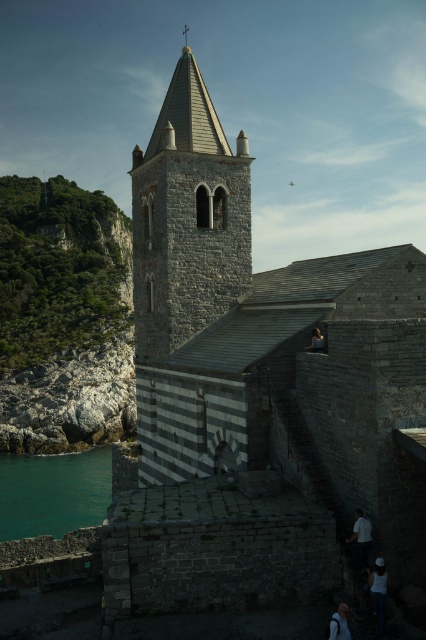
Looking at this image, is gray stone church at center bigger than smooth gray hair at center?

Yes, gray stone church at center is bigger than smooth gray hair at center.

Is gray stone church at center shorter than smooth gray hair at center?

No.

In order to click on gray stone church at center in this screenshot , I will do `click(256, 392)`.

Is point (276, 428) closer to camera compared to point (219, 282)?

Yes, it is.

Is gray stone church at center shorter than gray stone tower at center?

In fact, gray stone church at center may be taller than gray stone tower at center.

What are the coordinates of `gray stone church at center` in the screenshot? It's located at (256, 392).

Where is `gray stone church at center`? gray stone church at center is located at coordinates (256, 392).

Consider the image. Can you confirm if white fabric shirt at lower right is positioned to the left of smooth gray hair at center?

In fact, white fabric shirt at lower right is to the right of smooth gray hair at center.

Does point (362, 525) come closer to viewer compared to point (336, 616)?

No, it is behind (336, 616).

I want to click on white fabric shirt at lower right, so click(360, 538).